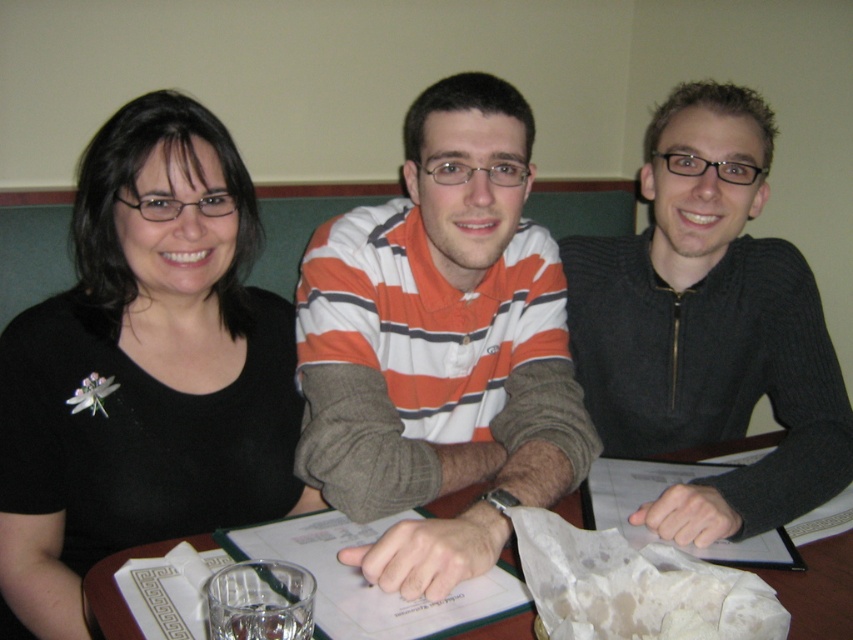
Which of these two, orange striped shirt at center or black ribbed sweater at center, stands shorter?

With less height is orange striped shirt at center.

Can you confirm if orange striped shirt at center is positioned to the left of black ribbed sweater at center?

Correct, you'll find orange striped shirt at center to the left of black ribbed sweater at center.

The image size is (853, 640). Describe the element at coordinates (440, 344) in the screenshot. I see `orange striped shirt at center` at that location.

At what (x,y) coordinates should I click in order to perform the action: click on orange striped shirt at center. Please return your answer as a coordinate pair (x, y). Looking at the image, I should click on (440, 344).

Does black ribbed sweater at center have a lesser height compared to wooden table at center?

Incorrect, black ribbed sweater at center's height does not fall short of wooden table at center's.

Image resolution: width=853 pixels, height=640 pixels. I want to click on black ribbed sweater at center, so click(x=708, y=326).

Is orange striped shirt at center smaller than wooden table at center?

No.

Does point (399, 285) lie behind point (166, 547)?

Yes, point (399, 285) is farther from viewer.

What do you see at coordinates (440, 344) in the screenshot? This screenshot has height=640, width=853. I see `orange striped shirt at center` at bounding box center [440, 344].

Locate an element on the screen. orange striped shirt at center is located at coordinates (440, 344).